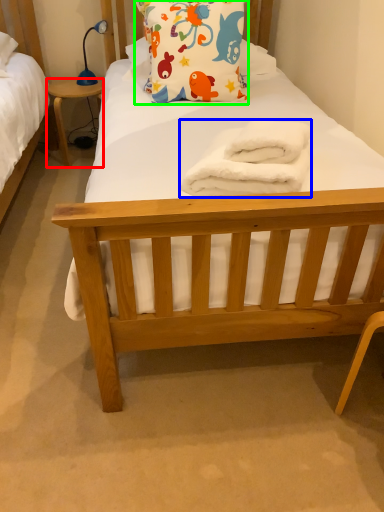
Question: Which is farther away from desk (highlighted by a red box)? towel/napkin (highlighted by a blue box) or pillow (highlighted by a green box)?

Choices:
 (A) towel/napkin
 (B) pillow

Answer: (A)